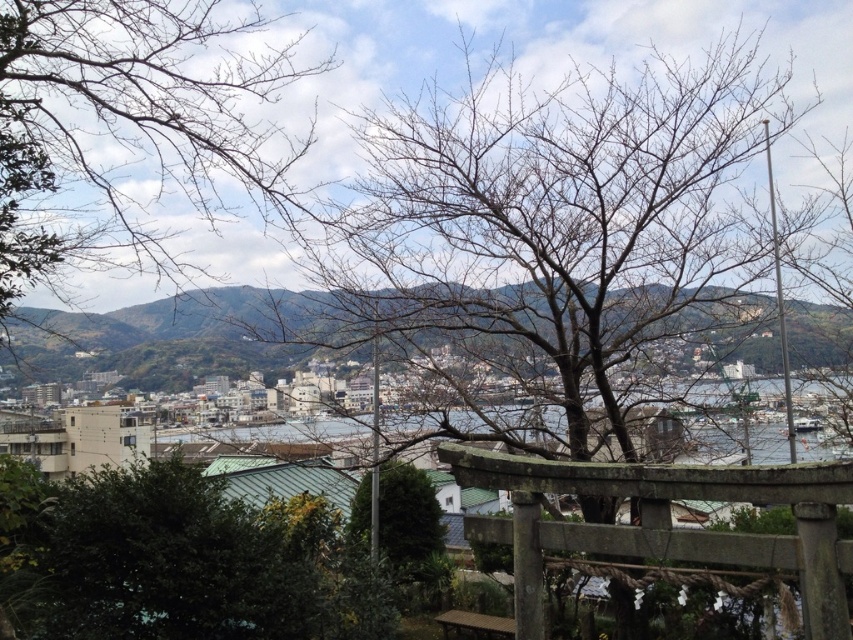
You are standing at the viewpoint of the coastal town scene. You see a bare wood tree at center and a weathered wood torii gate at center. Which object is positioned higher in the scene?

The bare wood tree at center is located above the weathered wood torii gate at center, so it is positioned higher in the scene.

You are standing at the torii gate in the foreground of the coastal town scene. Looking towards the midground, you notice a point marked at coordinates [582,294]. What object does this point correspond to?

The point corresponds to the bare wood tree at center, as indicated by the description.

You are standing at the torii gate in the foreground of the coastal town scene. You see a bare wood tree at center and a green leafy tree at center. Which tree would appear larger in your view?

The bare wood tree at center appears larger because it is closer to the viewer than the green leafy tree at center.